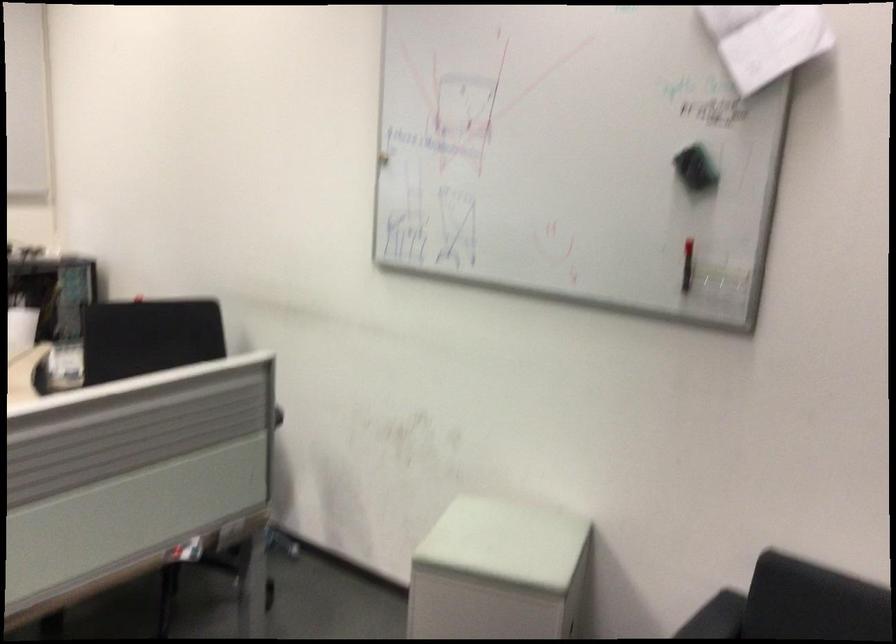
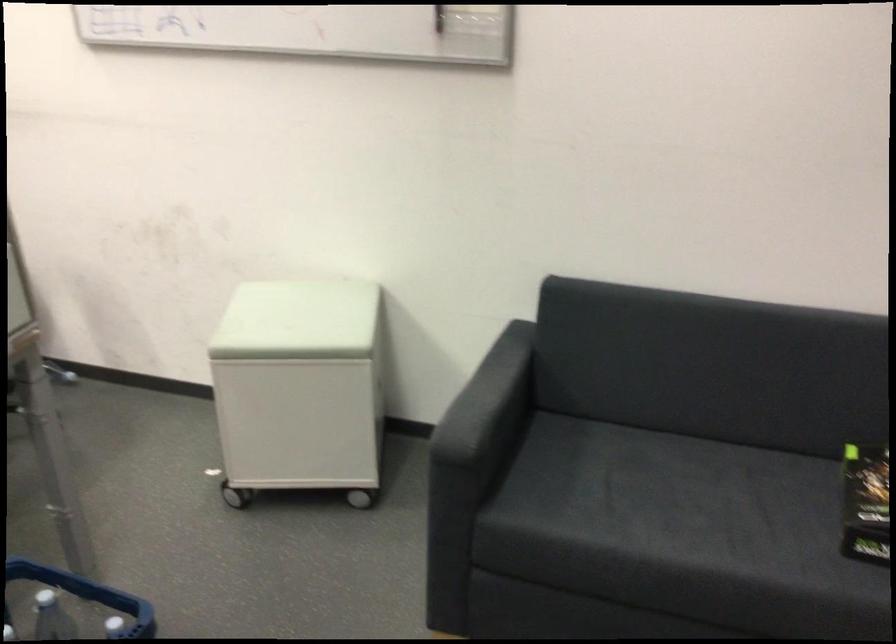
The point at (502, 543) is marked in the first image. Where is the corresponding point in the second image?

(297, 321)